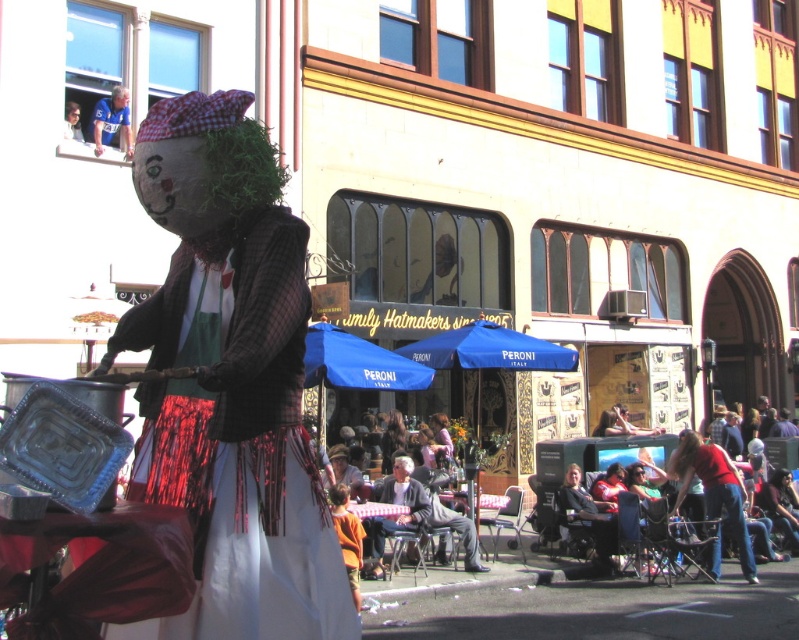
Question: Is matte plaid shirt at center above dark gray suit at center?

Choices:
 (A) yes
 (B) no

Answer: (A)

Question: Is matte plaid shirt at center closer to the viewer compared to dark gray suit at center?

Choices:
 (A) no
 (B) yes

Answer: (B)

Question: Which point appears closest to the camera in this image?

Choices:
 (A) (372, 550)
 (B) (213, 618)

Answer: (B)

Question: Does matte plaid shirt at center appear on the right side of dark gray suit at center?

Choices:
 (A) yes
 (B) no

Answer: (B)